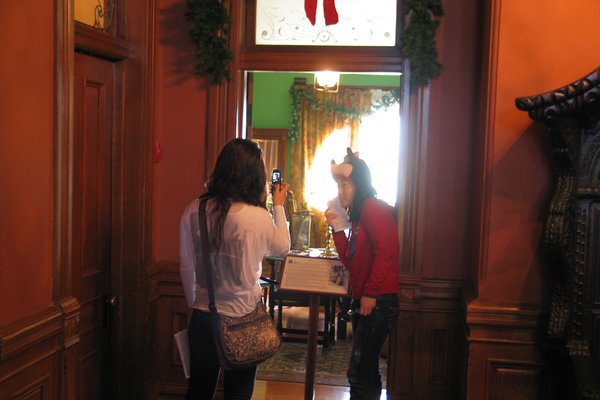
Where is `window`? This screenshot has width=600, height=400. window is located at coordinates (373, 138).